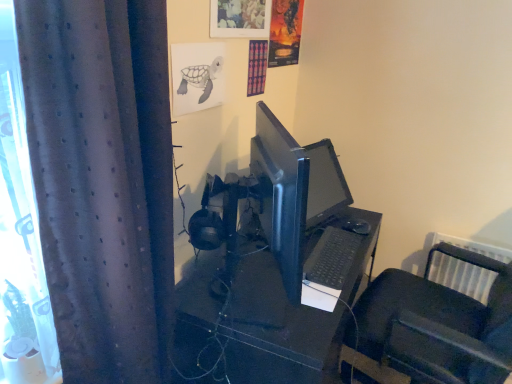
Question: Is black matte keyboard at center inside the boundaries of dark grey textured curtain at left, or outside?

Choices:
 (A) outside
 (B) inside

Answer: (A)

Question: Based on their positions, is black matte keyboard at center located to the left or right of dark grey textured curtain at left?

Choices:
 (A) left
 (B) right

Answer: (B)

Question: Estimate the real-world distances between objects in this image. Which object is farther from the black plastic desk at center?

Choices:
 (A) dark grey textured curtain at left
 (B) black plastic chair at lower right
 (C) black matte keyboard at center

Answer: (A)

Question: Which of these objects is positioned closest to the black plastic chair at lower right?

Choices:
 (A) dark grey textured curtain at left
 (B) black plastic desk at center
 (C) black matte keyboard at center

Answer: (B)